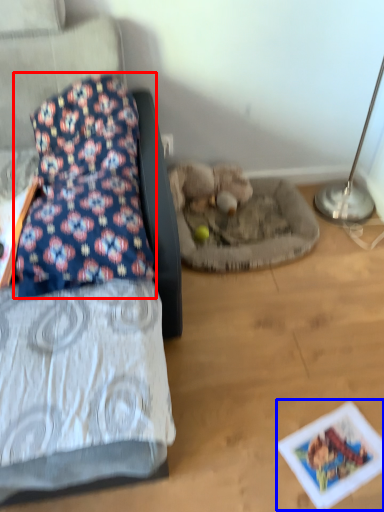
Question: Which point is closer to the camera, pillow (highlighted by a red box) or postcard (highlighted by a blue box)?

Choices:
 (A) pillow
 (B) postcard

Answer: (A)